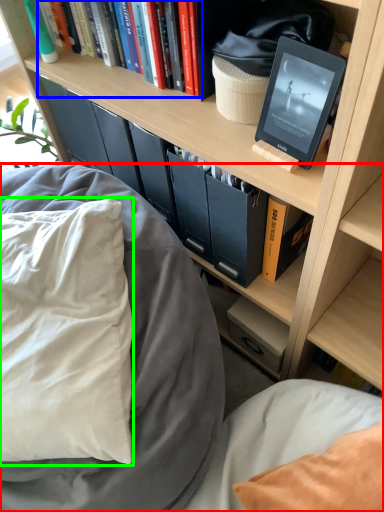
Question: Based on their relative distances, which object is nearer to bed (highlighted by a red box)? Choose from book (highlighted by a blue box) and pillow (highlighted by a green box).

Choices:
 (A) book
 (B) pillow

Answer: (B)